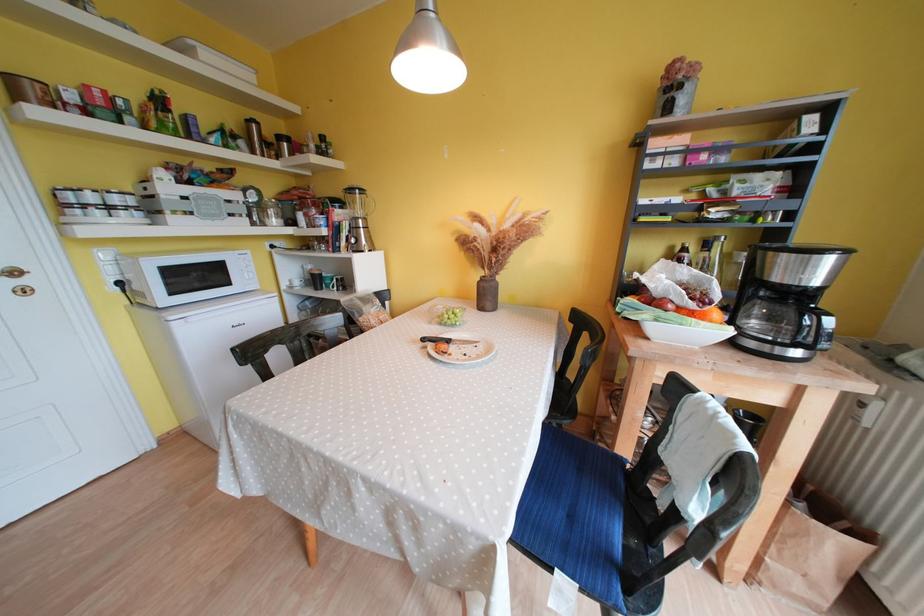
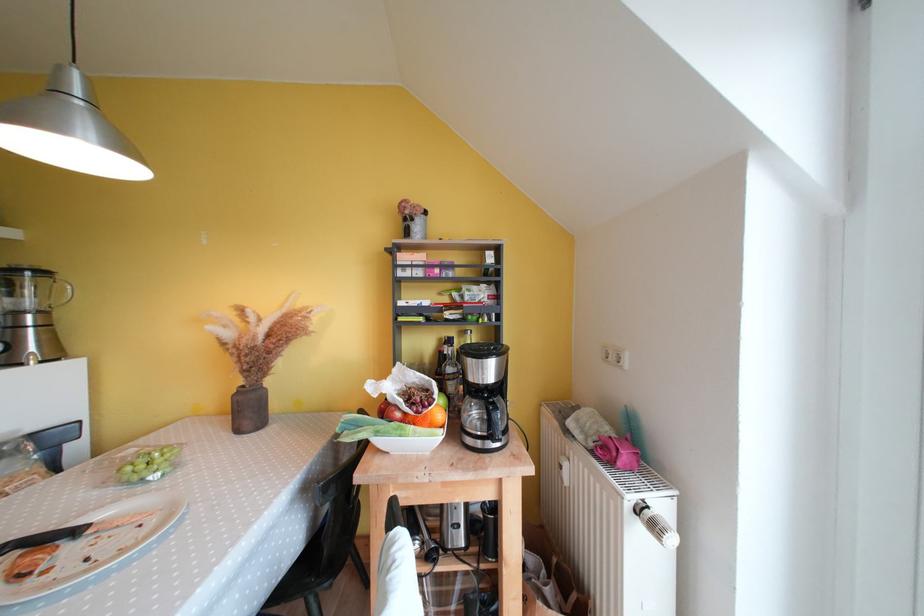
Locate, in the second image, the point that corresponds to point (371, 223) in the first image.

(49, 315)